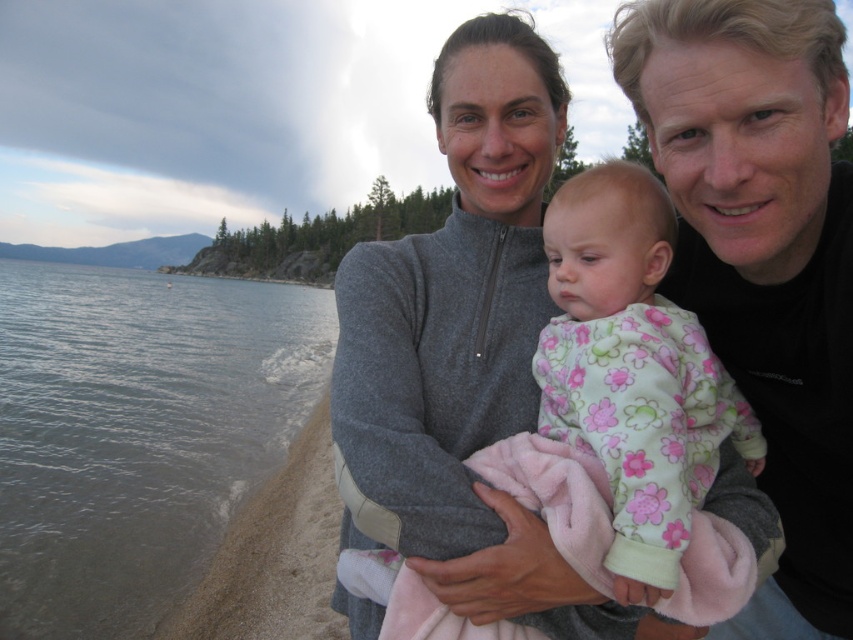
Question: Which point appears farthest from the camera in this image?

Choices:
 (A) (701, 365)
 (B) (683, 282)
 (C) (28, 445)

Answer: (C)

Question: Is black matte shirt at upper right positioned before fluffy pink pajamas at center?

Choices:
 (A) no
 (B) yes

Answer: (A)

Question: Can you confirm if gray water at lower left is bigger than black matte shirt at upper right?

Choices:
 (A) yes
 (B) no

Answer: (A)

Question: Which object appears closest to the camera in this image?

Choices:
 (A) fluffy pink pajamas at center
 (B) gray water at lower left

Answer: (A)

Question: Considering the relative positions of gray water at lower left and fluffy pink pajamas at center in the image provided, where is gray water at lower left located with respect to fluffy pink pajamas at center?

Choices:
 (A) above
 (B) below

Answer: (A)

Question: Which of the following is the farthest from the observer?

Choices:
 (A) (819, 528)
 (B) (625, 224)

Answer: (A)